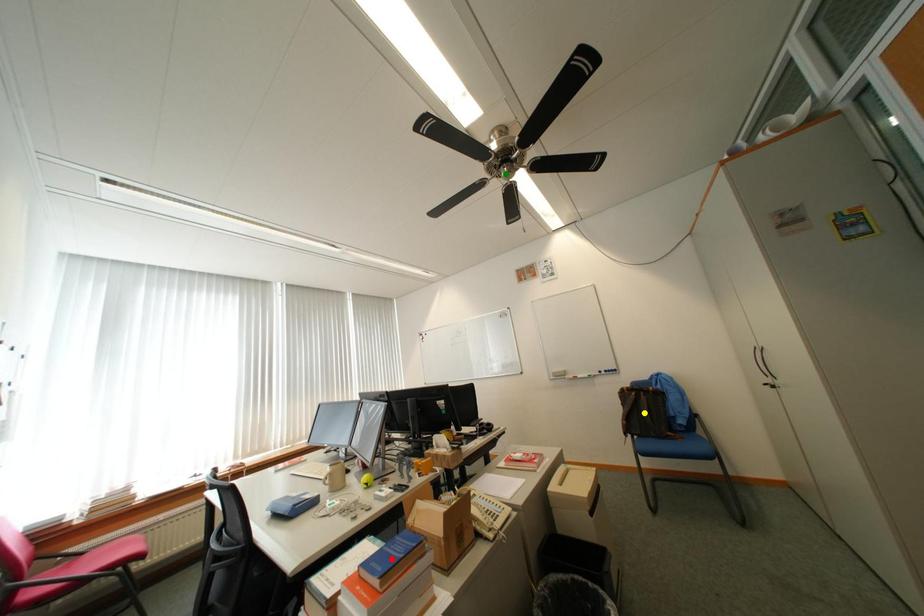
Order these from nearest to farthest:
green point | red point | yellow point

yellow point
green point
red point